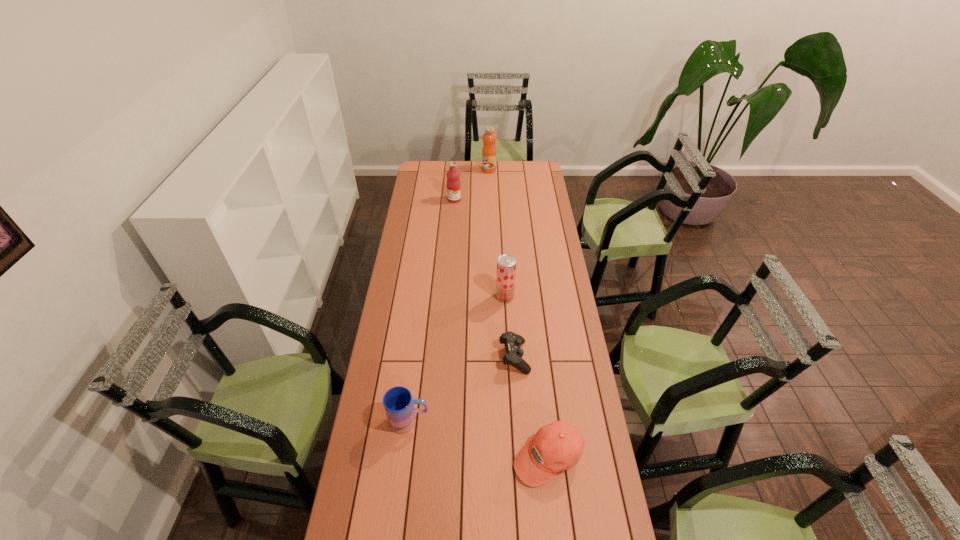
Locate an element on the screen. free space between the tallest object and the second shortest object is located at coordinates (518, 313).

This screenshot has height=540, width=960. Find the location of `vacant space in between the fourth nearest object and the second farthest object`. vacant space in between the fourth nearest object and the second farthest object is located at coordinates (480, 248).

This screenshot has height=540, width=960. I want to click on vacant space in between the baseball cap and the mug, so point(479,438).

Where is `vacant point located between the farthest object and the mug`? The height and width of the screenshot is (540, 960). vacant point located between the farthest object and the mug is located at coordinates (449, 295).

Find the location of a particular element. This screenshot has width=960, height=540. vacant space in between the farthest fruit juice and the fifth tallest object is located at coordinates (518, 313).

Locate an element on the screen. The height and width of the screenshot is (540, 960). vacant space in between the leftmost fruit juice and the shortest object is located at coordinates (485, 278).

You are a GUI agent. You are given a task and a screenshot of the screen. Output one action in this format:
    pyautogui.click(x=<x>, y=<y>)
    Task: Click on the blank region between the second shortest object and the leftmost fruit juice
    
    Given the screenshot: What is the action you would take?
    point(501,328)

Find the location of `vacant area that lies between the nearest fruit juice and the mug`. vacant area that lies between the nearest fruit juice and the mug is located at coordinates (457, 359).

The image size is (960, 540). In order to click on blank region between the fifth nearest object and the baseball cap in this screenshot , I will do `click(501, 328)`.

Where is `object that is the second closest one to the baseball cap`? Image resolution: width=960 pixels, height=540 pixels. object that is the second closest one to the baseball cap is located at coordinates (398, 403).